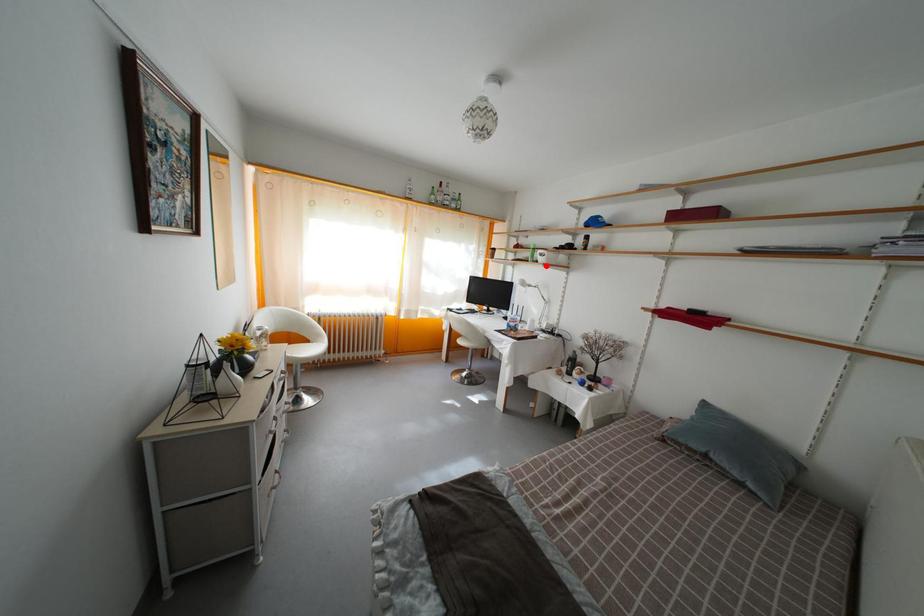
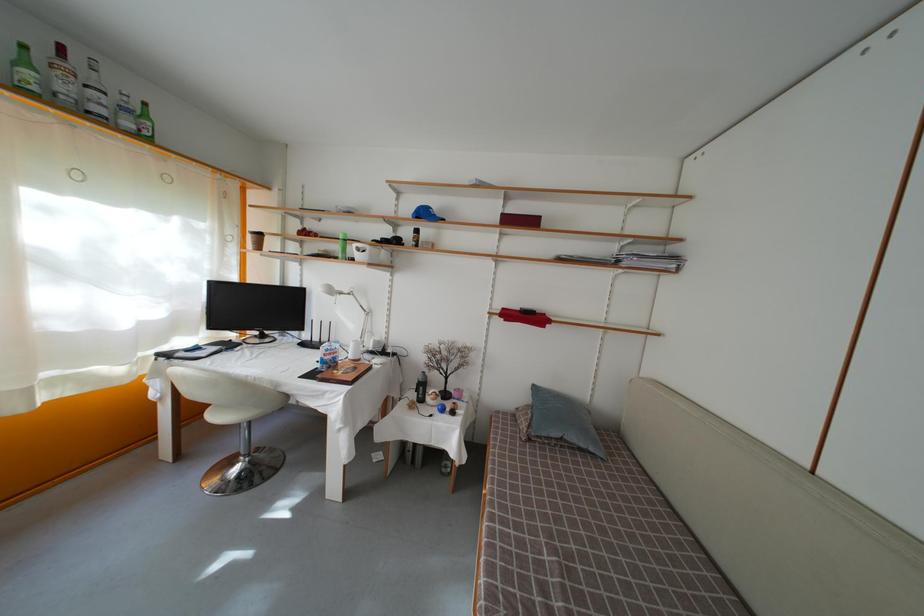
The point at the highlighted location is marked in the first image. Where is the corresponding point in the second image?

(363, 262)